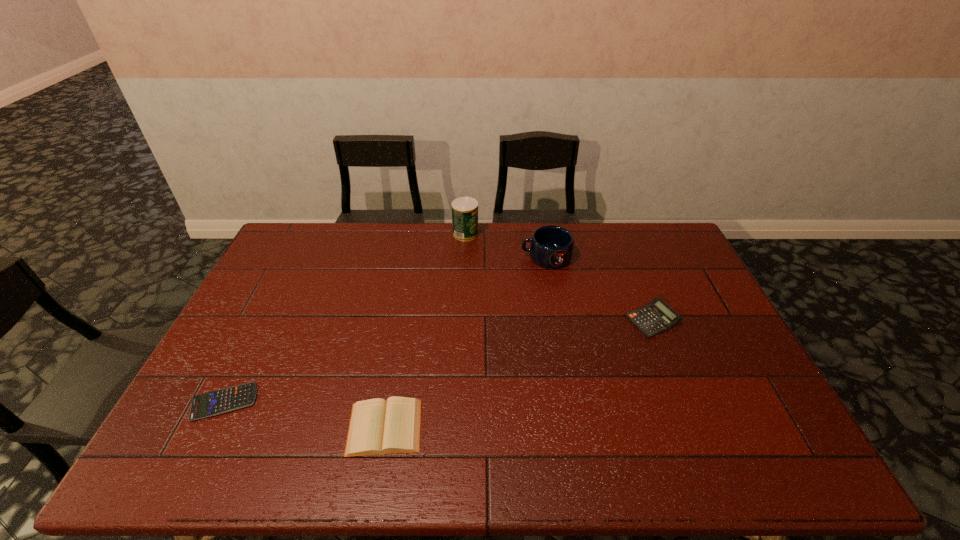
Locate an element on the screen. free space located 0.230m on the left of the third object from right to left is located at coordinates (393, 234).

Identify the location of free space located with the handle on the side of the second object from right to left. Image resolution: width=960 pixels, height=540 pixels. (417, 256).

Identify the location of free spot located with the handle on the side of the second object from right to left. This screenshot has width=960, height=540. (411, 256).

This screenshot has width=960, height=540. In order to click on vacant region located with the handle on the side of the second object from right to left in this screenshot , I will do `click(459, 256)`.

You are a GUI agent. You are given a task and a screenshot of the screen. Output one action in this format:
    pyautogui.click(x=<x>, y=<y>)
    Task: Click on the vacant space located 0.050m on the left of the third farthest object
    This screenshot has height=540, width=960.
    Given the screenshot: What is the action you would take?
    click(x=610, y=320)

Identify the location of free space located 0.340m on the left of the second object from left to right. The height and width of the screenshot is (540, 960). (206, 427).

Where is `vacant area located 0.340m on the right of the shorter calculator`? This screenshot has height=540, width=960. vacant area located 0.340m on the right of the shorter calculator is located at coordinates (390, 402).

The image size is (960, 540). In order to click on can positioned at the far edge in this screenshot , I will do `click(464, 209)`.

Where is `mug present at the far edge`? This screenshot has width=960, height=540. mug present at the far edge is located at coordinates (551, 246).

This screenshot has height=540, width=960. In order to click on object at the near edge in this screenshot , I will do `click(377, 427)`.